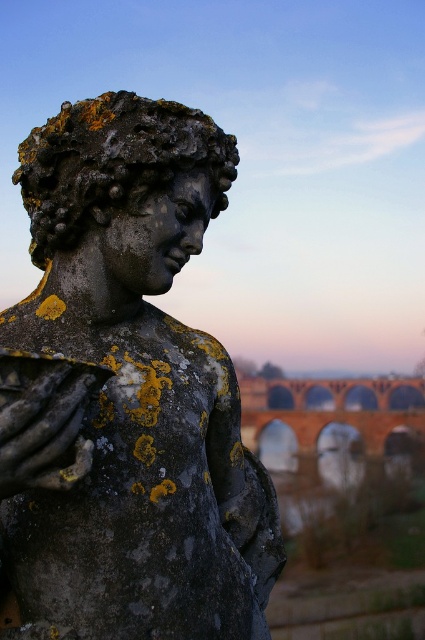
You are an architect analyzing the positioning of the rusty stone statue at upper left in the image. Given that the bridge in the background is at point 0.8, 0.5, can you determine the relative position of the statue compared to the bridge?

The rusty stone statue at upper left is located at point (x=136, y=388), which is to the left and slightly above the bridge at (x=212, y=512). Therefore, the statue is positioned northwest of the bridge.